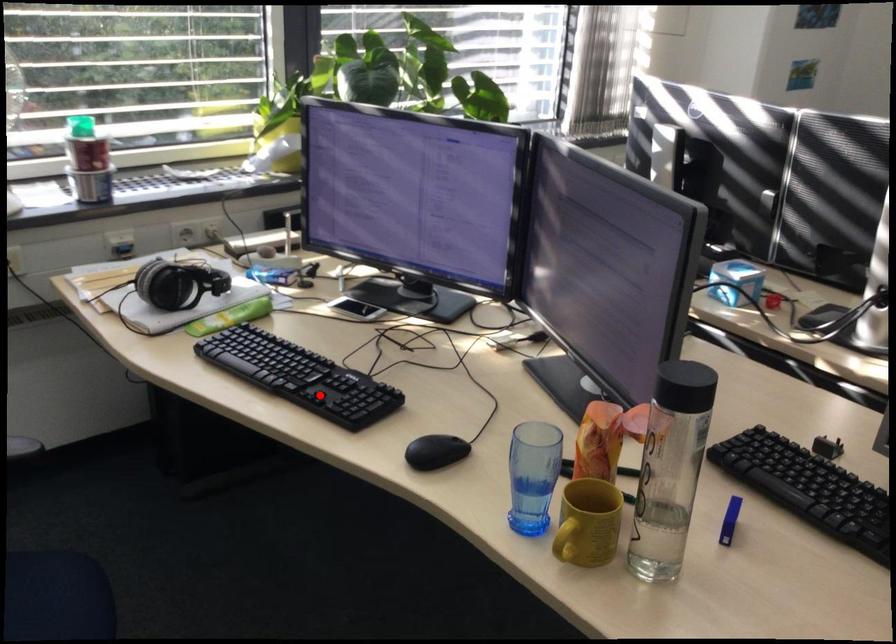
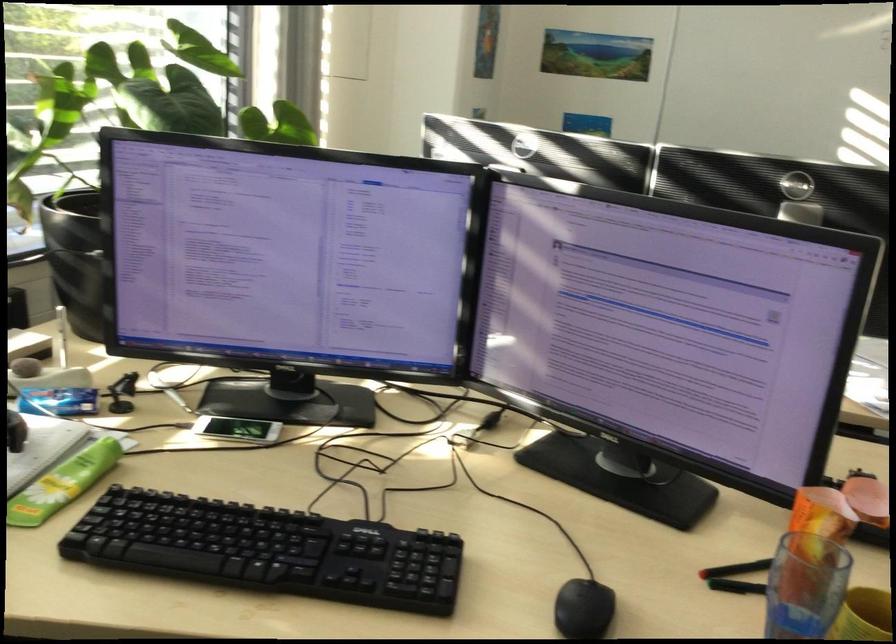
Find the pixel in the second image that matches the highlighted location in the first image.

(350, 578)